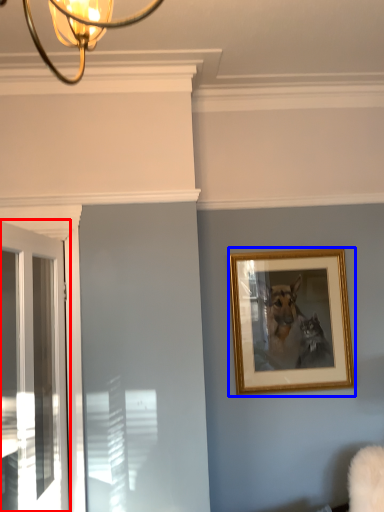
Question: Which point is further to the camera, door (highlighted by a red box) or picture frame (highlighted by a blue box)?

Choices:
 (A) door
 (B) picture frame

Answer: (B)